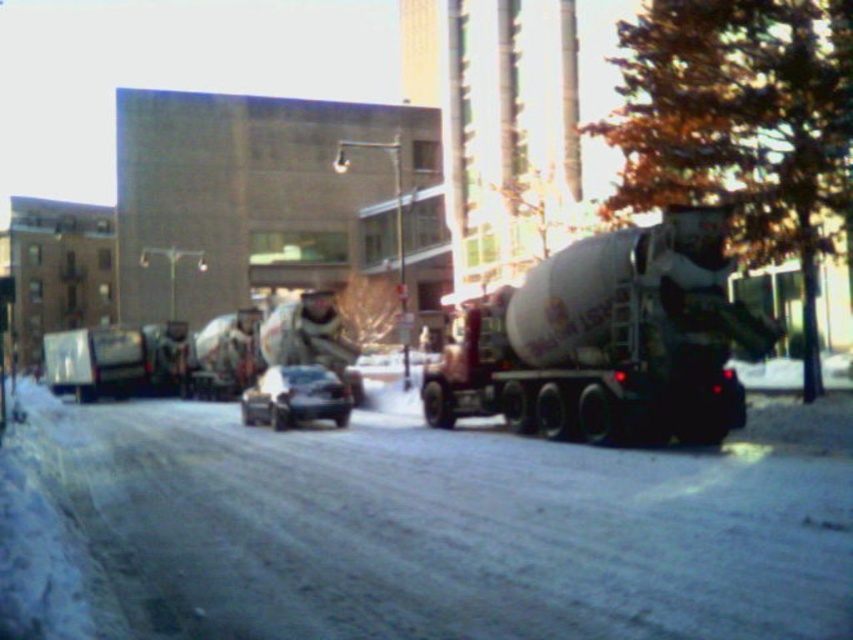
You are a pedestrian trying to cross the road at the center. There is a smooth concrete mixer at center and a shiny black sedan at center in your path. Which vehicle should you move towards to stay closer to the center of the road?

You should move towards the shiny black sedan at center because the smooth concrete mixer at center is to the right of the shiny black sedan at center, so the sedan is closer to the center of the road.

You are a pedestrian trying to cross the street from the left side. There is a white matte cement truck at right and a shiny black sedan at center. Which vehicle is closer to your starting position?

The shiny black sedan at center is closer to your starting position because it is positioned to the left of the white matte cement truck at right.

Consider the image. You are a delivery driver needing to park your truck, which is as large as the smooth concrete mixer at center. There is a space between the shiny black sedan at center and the curb. Can your truck fit in that space?

The smooth concrete mixer at center is larger than the shiny black sedan at center. Since your truck is as large as the smooth concrete mixer at center, it would not fit in the space between the shiny black sedan at center and the curb, which is likely sized for smaller vehicles like the sedan.